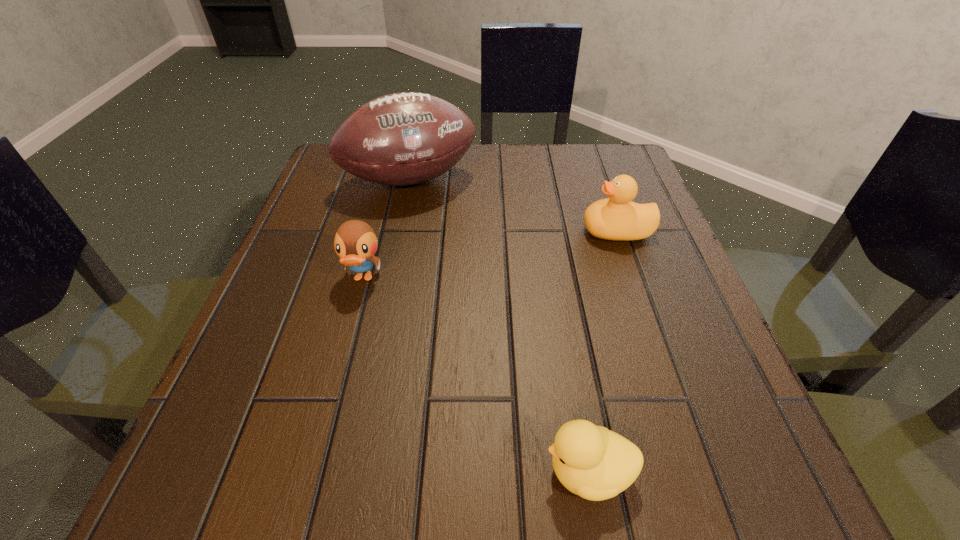
What are the coordinates of `the farthest object` in the screenshot? It's located at (407, 138).

Find the location of a particular element. This screenshot has width=960, height=540. football (American) is located at coordinates (407, 138).

Find the location of a particular element. Image resolution: width=960 pixels, height=540 pixels. the rightmost duck is located at coordinates (618, 218).

Identify the location of the farthest duck. (618, 218).

I want to click on the second nearest duck, so click(355, 242).

Where is `the second nearest object`? The image size is (960, 540). the second nearest object is located at coordinates (355, 242).

The height and width of the screenshot is (540, 960). I want to click on the shortest duck, so click(x=593, y=462).

Identify the location of the second duck from left to right. (593, 462).

Identify the location of vacant point located on the right of the farthest object. (620, 180).

Find the location of `blank area located 0.090m on the face of the farthest duck`. blank area located 0.090m on the face of the farthest duck is located at coordinates (538, 231).